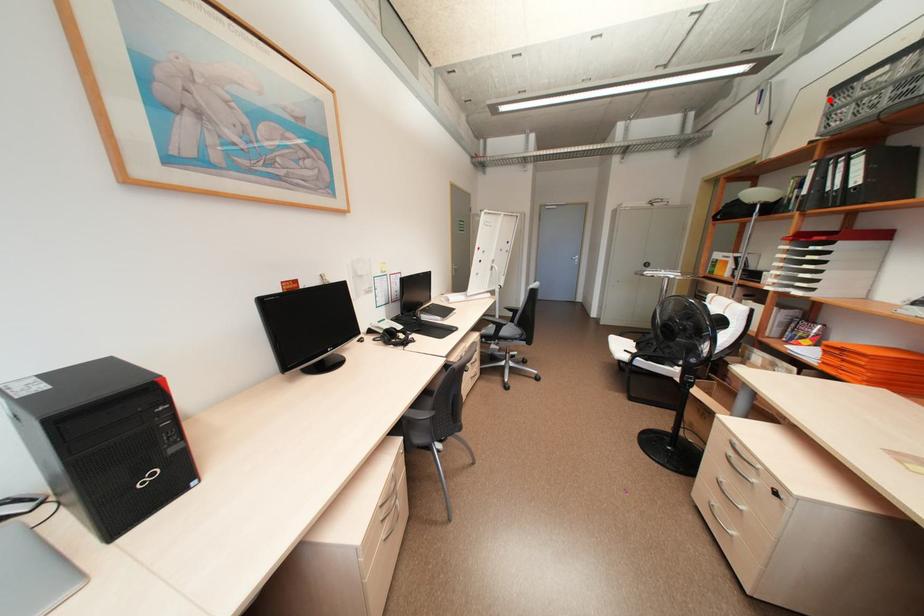
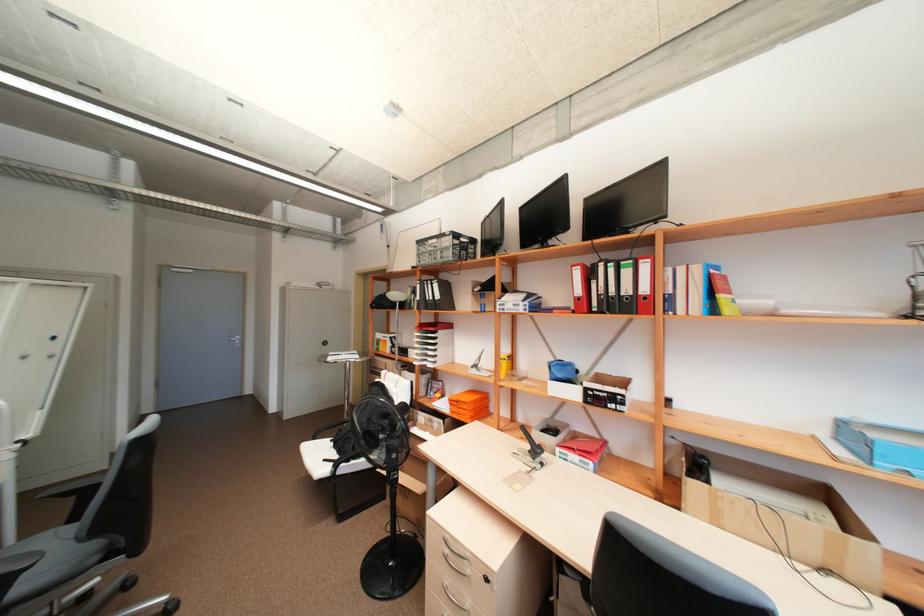
The point at the highlighted location is marked in the first image. Where is the corresponding point in the second image?

(420, 246)